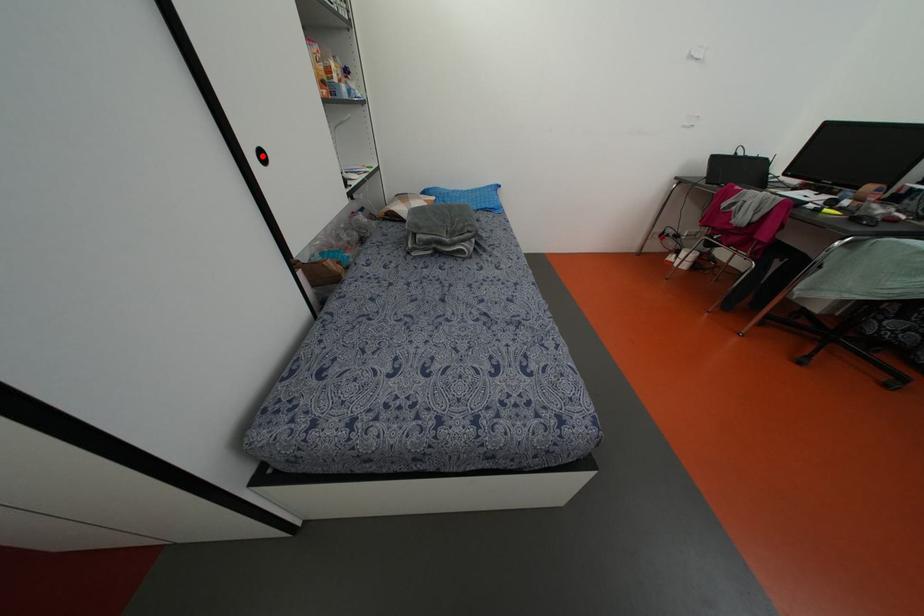
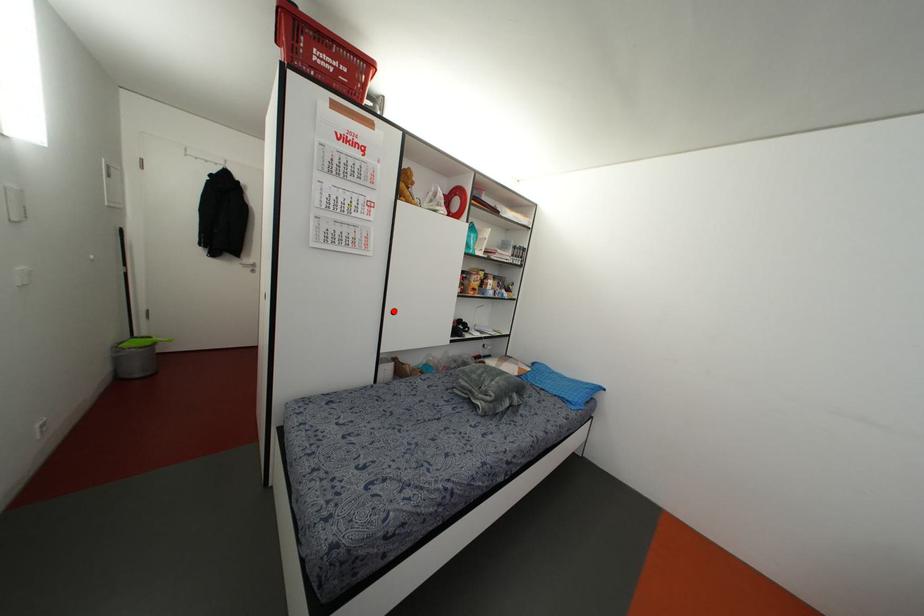
I am providing you with two images of the same scene from different viewpoints. A red point is marked on the first image and another point is marked on the second image. Is the marked point in image1 the same physical position as the marked point in image2?

Yes